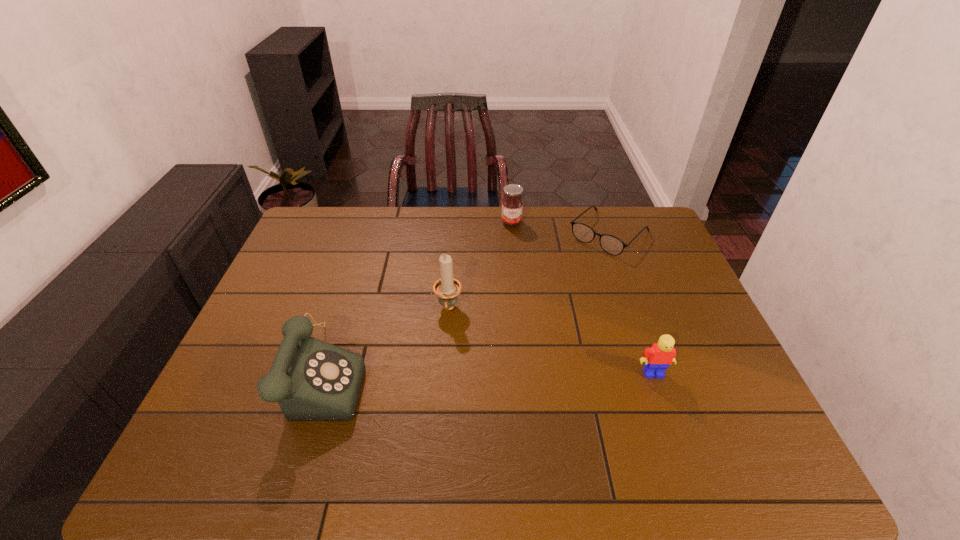
Find the location of `free spot on the desktop that is between the leftmost object and the Lego and is positioned on the label side of the jam`. free spot on the desktop that is between the leftmost object and the Lego and is positioned on the label side of the jam is located at coordinates (529, 373).

The image size is (960, 540). Find the location of `vacant space on the desktop that is between the telephone and the Lego and is positioned on the front-facing side of the shortest object`. vacant space on the desktop that is between the telephone and the Lego and is positioned on the front-facing side of the shortest object is located at coordinates tap(469, 373).

Find the location of a particular element. Image resolution: width=960 pixels, height=540 pixels. vacant space on the desktop that is between the leftmost object and the Lego and is positioned on the handle side of the third nearest object is located at coordinates (443, 373).